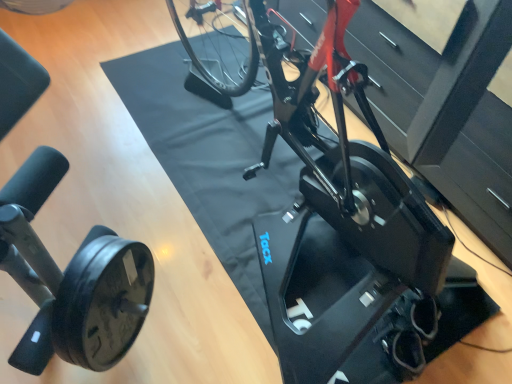
Question: Does black matte stationary bicycle at center, which is the first stationary bicycle in back-to-front order, have a lesser height compared to black rubber stationary bicycle at lower left, marked as the second stationary bicycle in a back-to-front arrangement?

Choices:
 (A) no
 (B) yes

Answer: (B)

Question: Is black matte stationary bicycle at center, the 2th stationary bicycle viewed from the front, at the left side of black rubber stationary bicycle at lower left, which is the first stationary bicycle in left-to-right order?

Choices:
 (A) yes
 (B) no

Answer: (B)

Question: From the image's perspective, is black matte stationary bicycle at center, which ranks as the second stationary bicycle in left-to-right order, located beneath black rubber stationary bicycle at lower left, which is the first stationary bicycle in left-to-right order?

Choices:
 (A) no
 (B) yes

Answer: (A)

Question: From a real-world perspective, is black matte stationary bicycle at center, which is the first stationary bicycle in back-to-front order, positioned over black rubber stationary bicycle at lower left, marked as the second stationary bicycle in a back-to-front arrangement, based on gravity?

Choices:
 (A) yes
 (B) no

Answer: (B)

Question: Does black matte stationary bicycle at center, which is the first stationary bicycle in back-to-front order, appear on the right side of black rubber stationary bicycle at lower left, which is the first stationary bicycle in left-to-right order?

Choices:
 (A) no
 (B) yes

Answer: (B)

Question: Is black matte stationary bicycle at center, which ranks as the second stationary bicycle in left-to-right order, spatially inside black rubber wheel at lower left, or outside of it?

Choices:
 (A) outside
 (B) inside

Answer: (A)

Question: From their relative heights in the image, would you say black matte stationary bicycle at center, which is the first stationary bicycle in back-to-front order, is taller or shorter than black rubber wheel at lower left?

Choices:
 (A) short
 (B) tall

Answer: (A)

Question: Looking at their shapes, would you say black matte stationary bicycle at center, which is the first stationary bicycle in back-to-front order, is wider or thinner than black rubber wheel at lower left?

Choices:
 (A) wide
 (B) thin

Answer: (A)

Question: In the image, is black matte stationary bicycle at center, the 2th stationary bicycle viewed from the front, on the left side or the right side of black rubber wheel at lower left?

Choices:
 (A) left
 (B) right

Answer: (B)

Question: Choose the correct answer: Is black rubber wheel at lower left inside black matte stationary bicycle at center, which is the first stationary bicycle in back-to-front order, or outside it?

Choices:
 (A) outside
 (B) inside

Answer: (A)

Question: Is black rubber wheel at lower left in front of or behind black matte stationary bicycle at center, the 2th stationary bicycle viewed from the front, in the image?

Choices:
 (A) behind
 (B) front

Answer: (B)

Question: Based on their positions, is black rubber wheel at lower left located to the left or right of black matte stationary bicycle at center, which ranks as the second stationary bicycle in left-to-right order?

Choices:
 (A) right
 (B) left

Answer: (B)

Question: Does point (116, 337) appear closer or farther from the camera than point (470, 11)?

Choices:
 (A) closer
 (B) farther

Answer: (A)

Question: Considering the positions of black matte stationary bicycle at center, the 2th stationary bicycle viewed from the front, and black rubber stationary bicycle at lower left, marked as the second stationary bicycle in a back-to-front arrangement, in the image, is black matte stationary bicycle at center, the 2th stationary bicycle viewed from the front, taller or shorter than black rubber stationary bicycle at lower left, marked as the second stationary bicycle in a back-to-front arrangement,?

Choices:
 (A) tall
 (B) short

Answer: (B)

Question: From a real-world perspective, is black matte stationary bicycle at center, the 2th stationary bicycle viewed from the front, above or below black rubber stationary bicycle at lower left, acting as the 1th stationary bicycle starting from the front?

Choices:
 (A) below
 (B) above

Answer: (A)